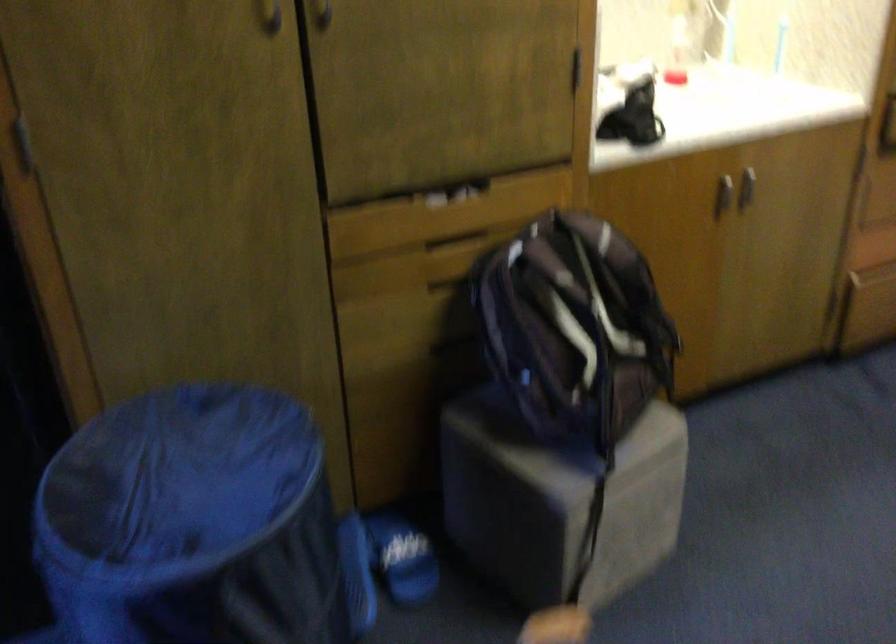
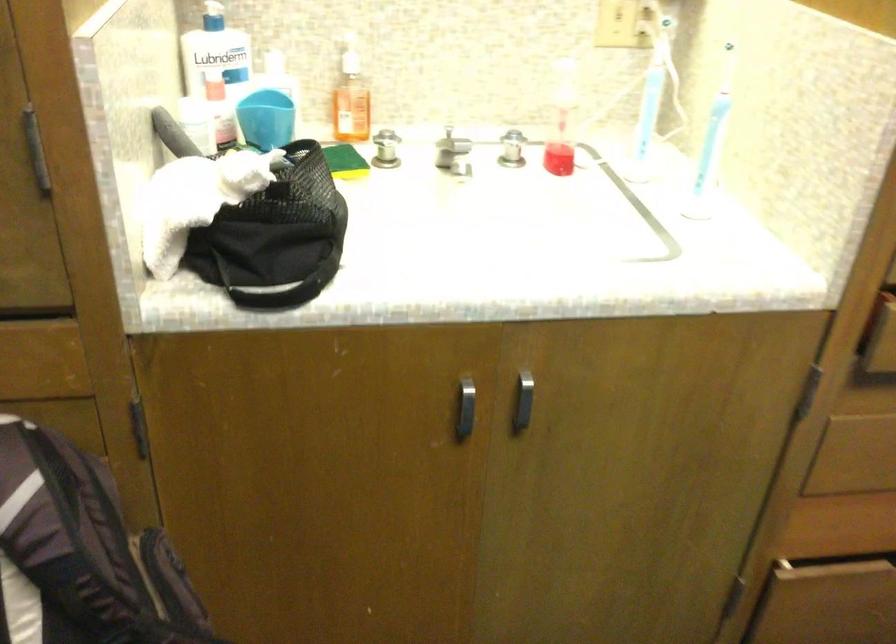
In a continuous first-person perspective shot, in which direction is the camera moving?

The movement direction of the cameraman is right, forward.